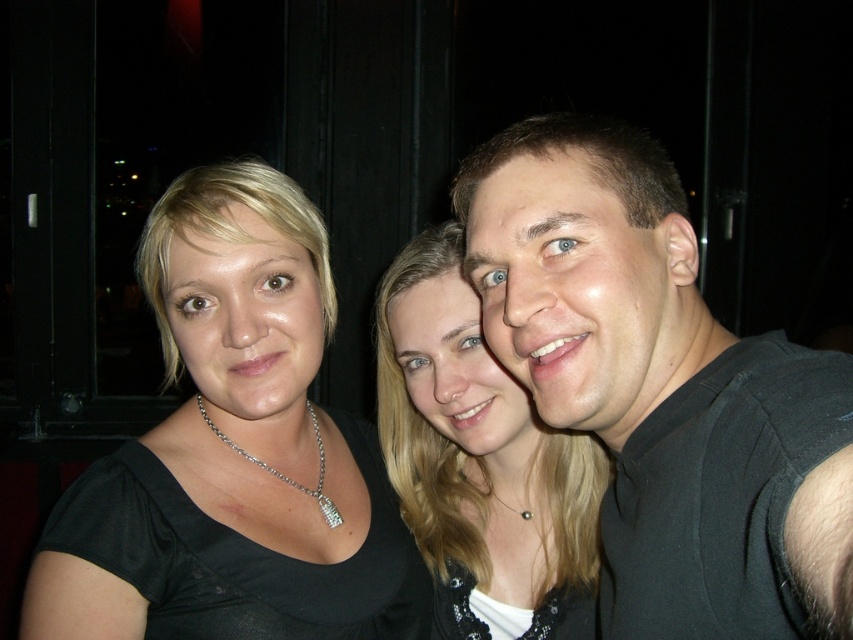
You are standing in a dark room with three people taking a selfie. You see the black satin top at left. Can you reach out and touch it without moving your feet?

The black satin top at left is 35.12 inches away from the viewer. Since the average arm length is about 25 inches, you cannot reach it without moving your feet.